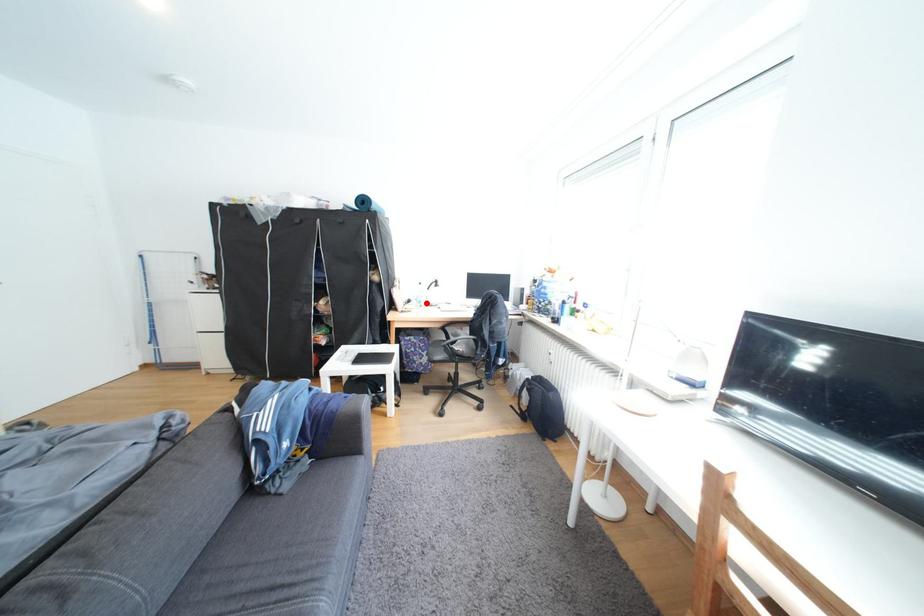
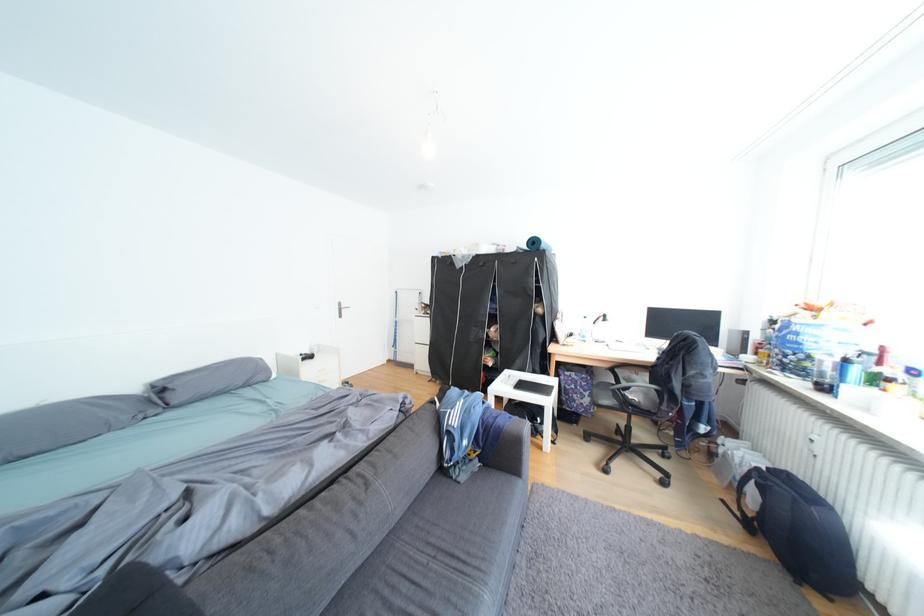
Question: I am providing you with two images of the same scene from different viewpoints. A red point is shown in image1. For the corresponding object point in image2, is it positioned nearer or farther from the camera?

Choices:
 (A) Nearer
 (B) Farther

Answer: (B)